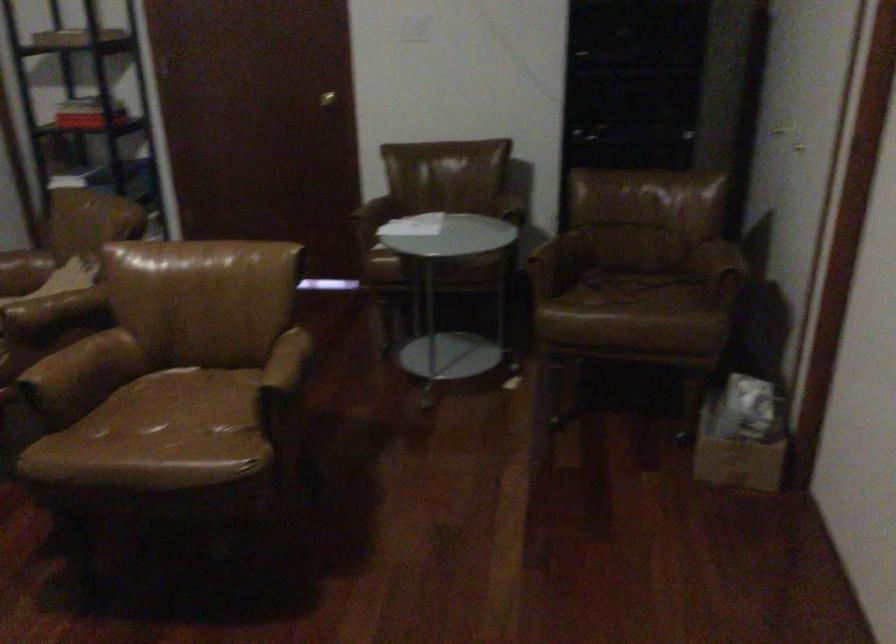
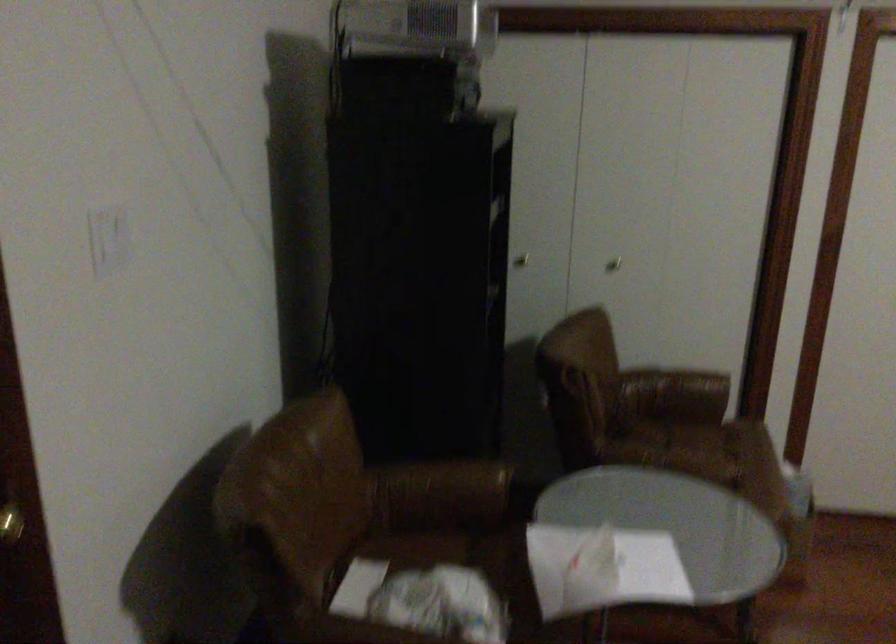
Where in the second image is the point corresponding to pixel 498 207 from the first image?

(442, 488)